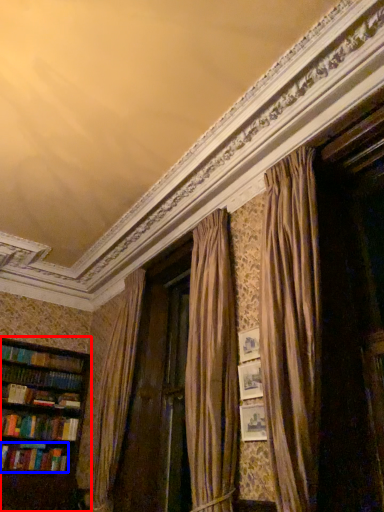
Question: Which point is further to the camera, bookcase (highlighted by a red box) or book (highlighted by a blue box)?

Choices:
 (A) bookcase
 (B) book

Answer: (B)